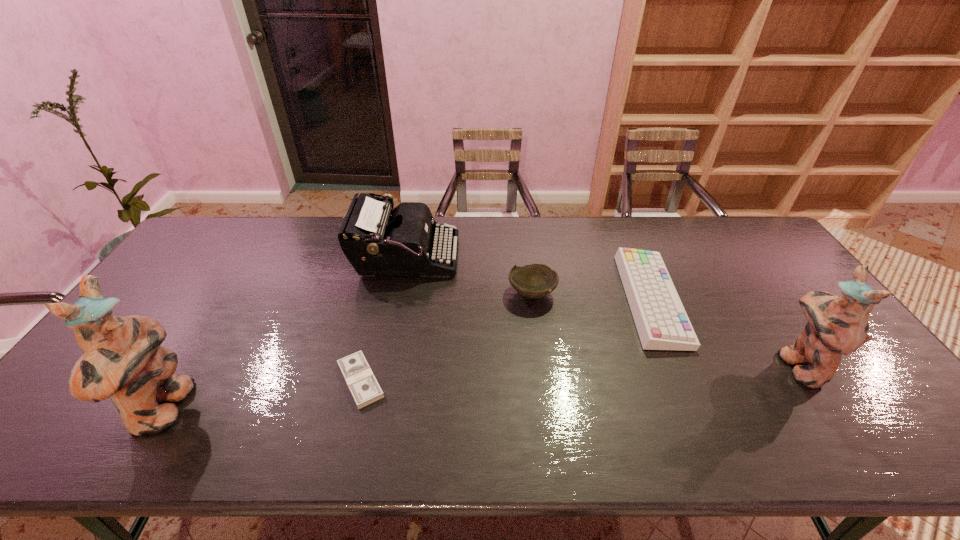
The image size is (960, 540). Identify the location of vacant area that lies between the dollar and the second tallest object. (580, 373).

You are a GUI agent. You are given a task and a screenshot of the screen. Output one action in this format:
    pyautogui.click(x=<x>, y=<y>)
    Task: Click on the blank region between the shortest object and the typewriter
    The image size is (960, 540).
    Given the screenshot: What is the action you would take?
    pyautogui.click(x=383, y=319)

This screenshot has height=540, width=960. Identify the location of empty space that is in between the right figurine and the second object from right to left. (725, 332).

Locate an element on the screen. The width and height of the screenshot is (960, 540). free spot between the leftmost object and the dollar is located at coordinates (262, 395).

Where is `free point between the second shortest object and the third shortest object`? This screenshot has height=540, width=960. free point between the second shortest object and the third shortest object is located at coordinates (591, 296).

Locate which object is the fourth closest to the shortest object. Please provide its 2D coordinates. Your answer should be formatted as a tuple, i.e. [(x, y)], where the tuple contains the x and y coordinates of a point satisfying the conditions above.

[(662, 323)]

Identify which object is located as the fourth nearest to the shortest object. Please provide its 2D coordinates. Your answer should be formatted as a tuple, i.e. [(x, y)], where the tuple contains the x and y coordinates of a point satisfying the conditions above.

[(662, 323)]

This screenshot has width=960, height=540. Identify the location of free space that satisfies the following two spatial constraints: 1. on the typing side of the fourth tallest object; 2. on the right side of the fourth shortest object. (398, 293).

You are a GUI agent. You are given a task and a screenshot of the screen. Output one action in this format:
    pyautogui.click(x=<x>, y=<y>)
    Task: Click on the vacant area in the image that satisfies the following two spatial constraints: 1. on the front side of the shortest object; 2. on the front-facing side of the tallest object
    Image resolution: width=960 pixels, height=540 pixels.
    Given the screenshot: What is the action you would take?
    pyautogui.click(x=353, y=410)

This screenshot has width=960, height=540. I want to click on blank area in the image that satisfies the following two spatial constraints: 1. on the typing side of the typewriter; 2. on the left side of the fourth tallest object, so click(398, 293).